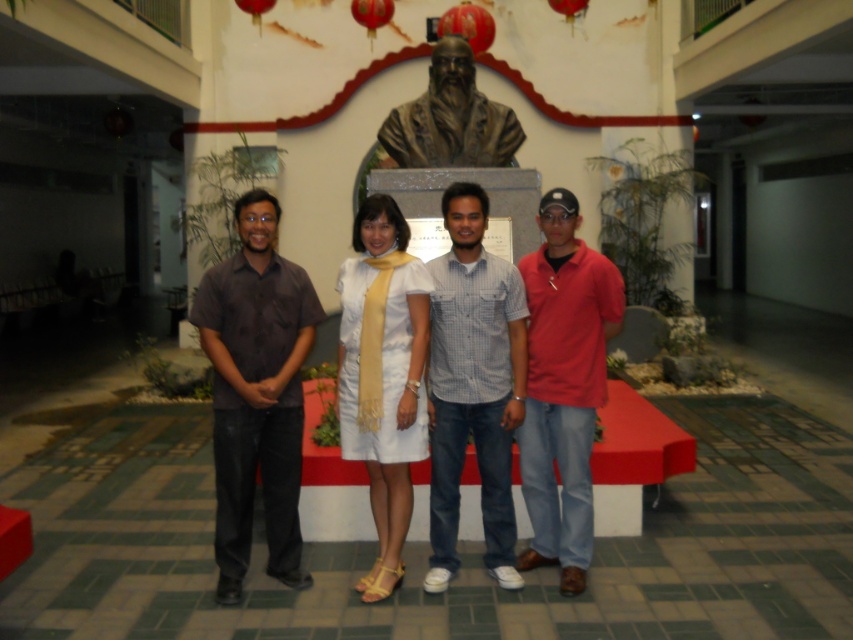
Question: Among these objects, which one is farthest from the camera?

Choices:
 (A) dark gray shirt at left
 (B) bronze bust at center
 (C) checkered fabric shirt at center

Answer: (B)

Question: Can you confirm if dark gray shirt at left is thinner than checkered fabric shirt at center?

Choices:
 (A) no
 (B) yes

Answer: (A)

Question: Is red cotton polo shirt at right above bronze bust at center?

Choices:
 (A) yes
 (B) no

Answer: (B)

Question: Which object is the closest to the dark gray shirt at left?

Choices:
 (A) bronze bust at center
 (B) red cotton polo shirt at right

Answer: (B)

Question: Is red cotton polo shirt at right positioned behind bronze bust at center?

Choices:
 (A) yes
 (B) no

Answer: (B)

Question: Which of the following is the farthest from the observer?

Choices:
 (A) (457, 502)
 (B) (590, 416)
 (C) (271, 344)
 (D) (442, 124)

Answer: (D)